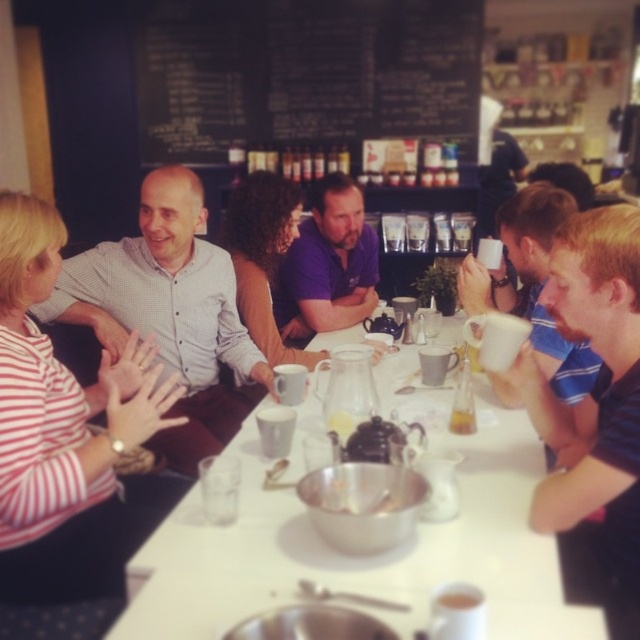
You are sitting at the long white table in the image and want to reach both the point at coordinates [234,426] and the point at coordinates [440,595]. Which point will you reach first if you extend your arm straight out?

You will reach the point at coordinates [234,426] first because it is closer to you than the point at coordinates [440,595], which is further away.

You are organizing a seating arrangement for a dinner event and need to decide where to place two guests based on their clothing. The guests are wearing a matte white shirt at center and a purple cotton shirt at center. Which guest should you seat in a seat with more space considering their shirt width?

The matte white shirt at center has a larger width than the purple cotton shirt at center, so the guest wearing the matte white shirt at center should be seated in the seat with more space to accommodate their shirt width.

Looking at this image, you are a photographer standing at the camera position. You want to take a closeup photo of the matte white shirt at center. The camera has a minimum focusing distance of 1.5 meters. Can you take the photo without moving closer?

The matte white shirt at center is 1.85 meters from the camera, which is beyond the minimum focusing distance of 1.5 meters. Therefore, you can take the closeup photo without moving closer.